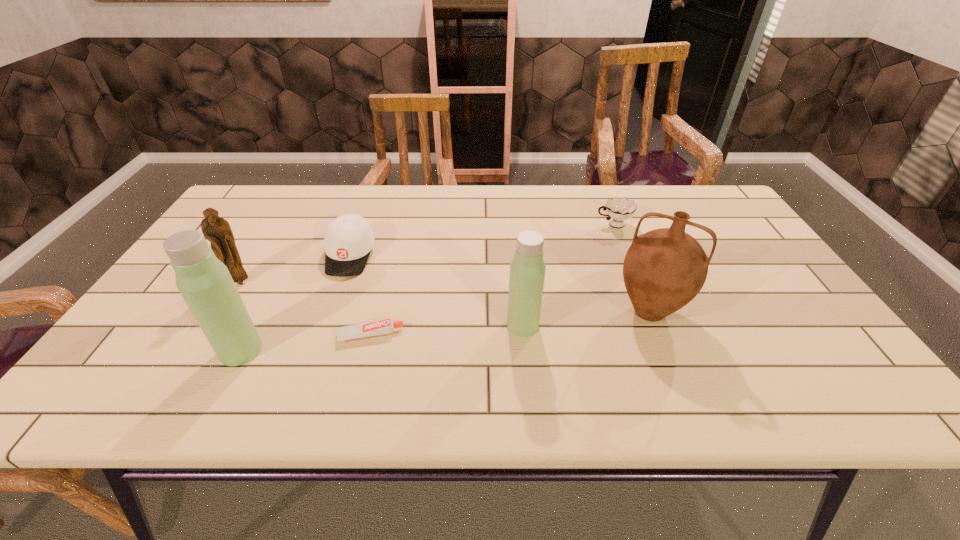
Please show where to add a thermos bottle on the right while keeping spacing even. Please provide its 2D coordinates. Your answer should be formatted as a tuple, i.e. [(x, y)], where the tuple contains the x and y coordinates of a point satisfying the conditions above.

[(775, 303)]